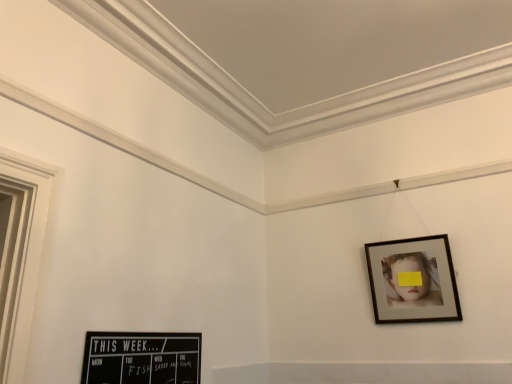
Question: Is black chalkboard at lower left, which is the second picture frame from back to front, taller or shorter than wooden frame at upper right, which is the second picture frame in left-to-right order?

Choices:
 (A) tall
 (B) short

Answer: (B)

Question: Based on their sizes in the image, would you say black chalkboard at lower left, the 2th picture frame in the right-to-left sequence, is bigger or smaller than wooden frame at upper right, which is the second picture frame in left-to-right order?

Choices:
 (A) big
 (B) small

Answer: (B)

Question: Is point (184, 334) positioned closer to the camera than point (394, 269)?

Choices:
 (A) farther
 (B) closer

Answer: (B)

Question: Would you say wooden frame at upper right, which ranks as the first picture frame in back-to-front order, is to the left or to the right of black chalkboard at lower left, acting as the 1th picture frame starting from the left, in the picture?

Choices:
 (A) right
 (B) left

Answer: (A)

Question: In terms of size, does wooden frame at upper right, the 1th picture frame from the right, appear bigger or smaller than black chalkboard at lower left, the 2th picture frame in the right-to-left sequence?

Choices:
 (A) big
 (B) small

Answer: (A)

Question: Considering their positions, is wooden frame at upper right, which ranks as the first picture frame in back-to-front order, located in front of or behind black chalkboard at lower left, which is the second picture frame from back to front?

Choices:
 (A) front
 (B) behind

Answer: (B)

Question: Would you say wooden frame at upper right, the 1th picture frame from the right, is inside or outside black chalkboard at lower left, acting as the 1th picture frame starting from the left?

Choices:
 (A) inside
 (B) outside

Answer: (B)